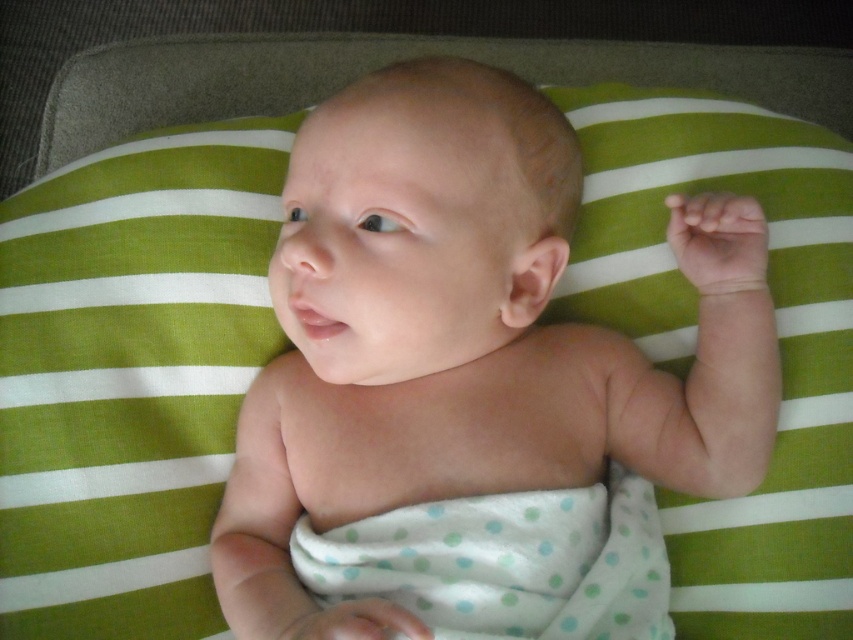
Based on the photo, you are a photographer setting up a shoot with a baby. The baby is lying on a green and white striped fabric surface. You need to position a small prop between the smooth skin baby at center and the white polka dot fabric at center. Based on their positions, where should you place the prop?

Since the smooth skin baby at center is in front of the white polka dot fabric at center, you should place the prop between the baby and the fabric, closer to the baby to ensure it stays within the frame and maintains focus on the subject.

You are a photographer taking a picture of the baby. You need to ensure the smooth skin baby at center is centered in the frame. However, the white polka dot fabric at center is currently to the right of the baby. How should you adjust the camera to correctly frame the baby?

The smooth skin baby at center is positioned on the left side of white polka dot fabric at center. To center the baby, move the camera to the right so the baby aligns with the center of the frame.

You are holding a toy that is 12 inches long and want to place it near the point at coordinates point (294,250). If the distance between you and the point is 27.91 inches, can you place the toy so that it reaches from your current position to the point?

The distance between you and the point (294,250) is 27.91 inches. Since the toy is only 12 inches long, it cannot reach from your current position to the point because the toy is shorter than the distance required.